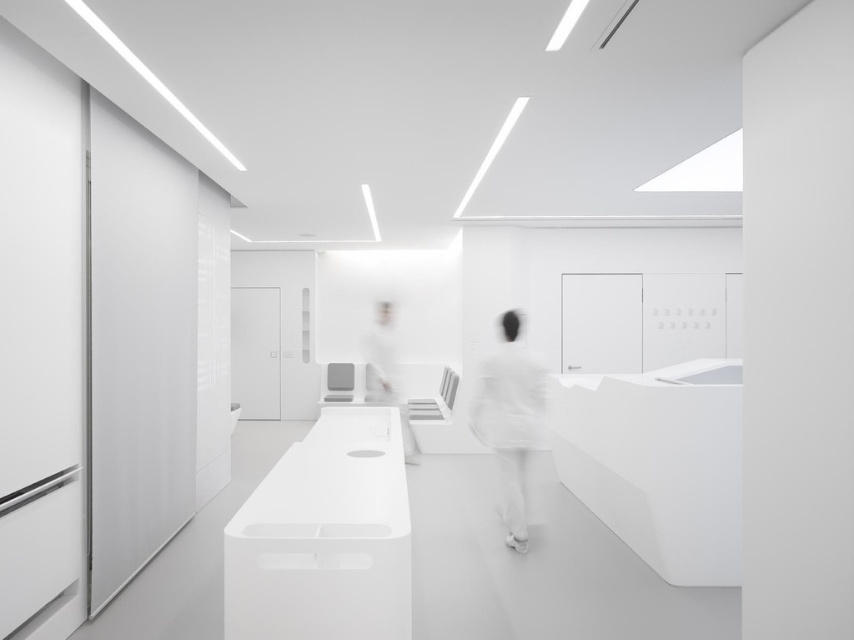
Question: Which of the following is the closest to the observer?

Choices:
 (A) (377, 355)
 (B) (502, 448)

Answer: (B)

Question: Is white matte uniform at center further to the viewer compared to white glossy person at center?

Choices:
 (A) no
 (B) yes

Answer: (A)

Question: From the image, what is the correct spatial relationship of white matte uniform at center in relation to white glossy person at center?

Choices:
 (A) above
 (B) below

Answer: (B)

Question: Does white matte uniform at center have a lesser width compared to white glossy person at center?

Choices:
 (A) no
 (B) yes

Answer: (B)

Question: Which point is closer to the camera taking this photo?

Choices:
 (A) (512, 540)
 (B) (389, 307)

Answer: (A)

Question: Which point is farther from the camera taking this photo?

Choices:
 (A) (500, 321)
 (B) (375, 397)

Answer: (B)